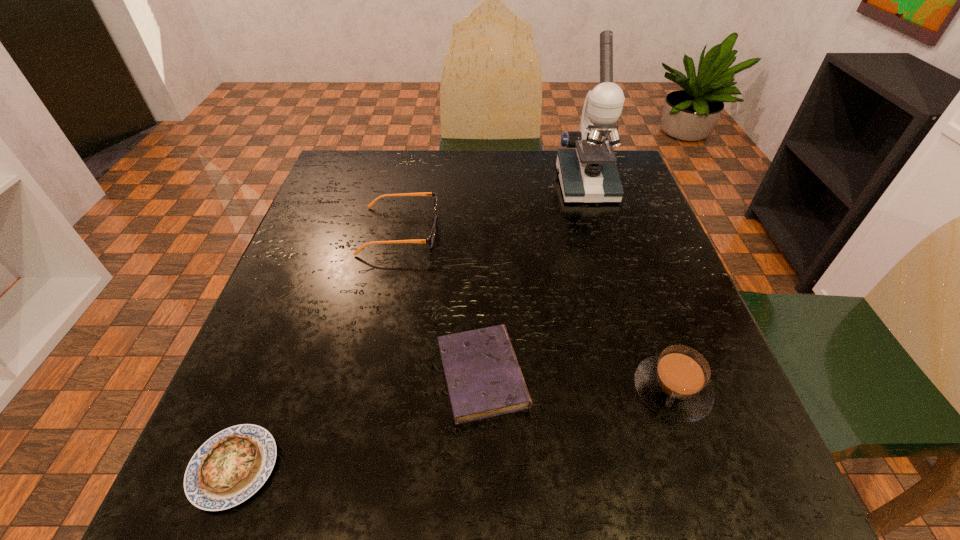
Find the location of a particular element. The image size is (960, 540). object at the far right corner is located at coordinates (587, 170).

What are the coordinates of `vacant region at the far edge of the desktop` in the screenshot? It's located at (421, 181).

Find the location of a particular element. vacant position at the near edge of the desktop is located at coordinates (481, 488).

In the image, there is a desktop. Find the location of `blank space at the left edge`. blank space at the left edge is located at coordinates (311, 228).

You are a GUI agent. You are given a task and a screenshot of the screen. Output one action in this format:
    pyautogui.click(x=<x>, y=<y>)
    Task: Click on the vacant space at the right edge of the desktop
    This screenshot has width=960, height=540.
    Given the screenshot: What is the action you would take?
    pyautogui.click(x=606, y=295)

In the image, there is a desktop. Where is `blank space at the far left corner`? The image size is (960, 540). blank space at the far left corner is located at coordinates (381, 165).

Locate an element on the screen. This screenshot has width=960, height=540. empty location between the microscope and the cappuccino is located at coordinates (629, 287).

Locate an element on the screen. The image size is (960, 540). free space between the cappuccino and the quiche is located at coordinates (453, 429).

This screenshot has height=540, width=960. In order to click on free point between the farthest object and the third object from right to left in this screenshot , I will do `click(534, 279)`.

At what (x,y) coordinates should I click in order to perform the action: click on vacant space in between the fourth shortest object and the third tallest object. Please return your answer as a coordinate pair (x, y). This screenshot has width=960, height=540. Looking at the image, I should click on (536, 310).